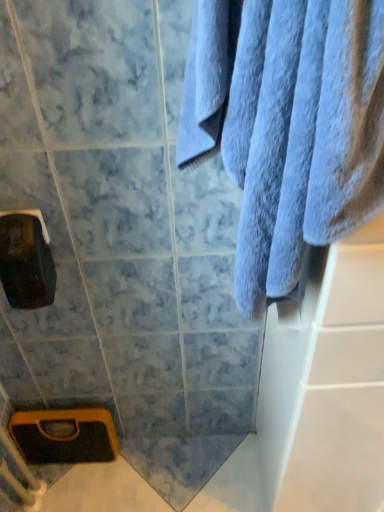
The height and width of the screenshot is (512, 384). Identify the location of blue soft towel at upper right. (288, 126).

Image resolution: width=384 pixels, height=512 pixels. What do you see at coordinates (288, 126) in the screenshot? I see `blue soft towel at upper right` at bounding box center [288, 126].

You are a GUI agent. You are given a task and a screenshot of the screen. Output one action in this format:
    pyautogui.click(x=<x>, y=<y>)
    Task: Click on the blue soft towel at upper right
    The image size is (384, 512).
    Given the screenshot: What is the action you would take?
    pyautogui.click(x=288, y=126)